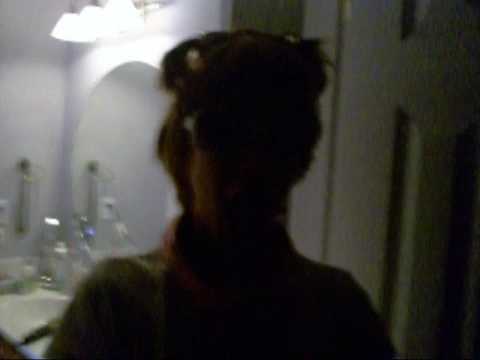
Where is `round mirror`? round mirror is located at coordinates (103, 123).